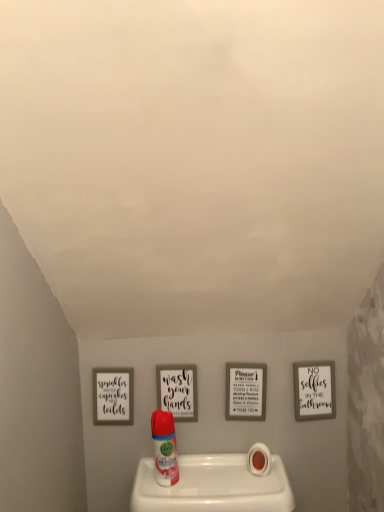
Question: From the image's perspective, relative to white matte toilet paper at lower center, is translucent plastic air freshener at center above or below?

Choices:
 (A) below
 (B) above

Answer: (B)

Question: In the image, is translucent plastic air freshener at center on the left side or the right side of white matte toilet paper at lower center?

Choices:
 (A) left
 (B) right

Answer: (A)

Question: From a real-world perspective, is translucent plastic air freshener at center positioned above or below white matte toilet paper at lower center?

Choices:
 (A) above
 (B) below

Answer: (A)

Question: From the image's perspective, relative to translucent plastic air freshener at center, is white matte toilet paper at lower center above or below?

Choices:
 (A) below
 (B) above

Answer: (A)

Question: Does point (253, 457) appear closer or farther from the camera than point (165, 415)?

Choices:
 (A) farther
 (B) closer

Answer: (A)

Question: Is white matte toilet paper at lower center taller or shorter than translucent plastic air freshener at center?

Choices:
 (A) tall
 (B) short

Answer: (B)

Question: Is white matte toilet paper at lower center wider or thinner than translucent plastic air freshener at center?

Choices:
 (A) thin
 (B) wide

Answer: (B)